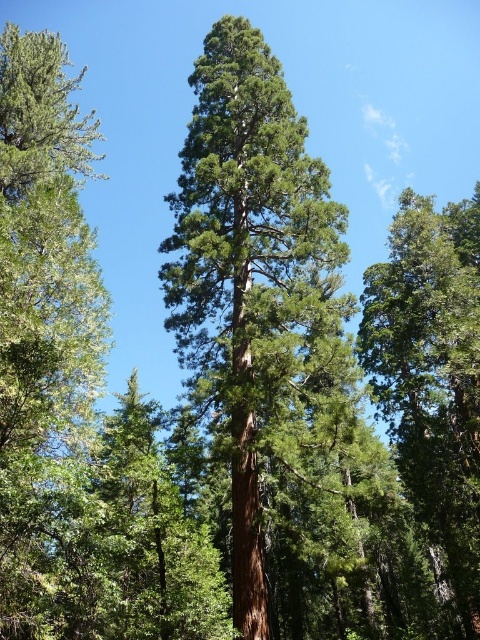
From the picture: Who is shorter, green rough bark tree at center or green matte tree at center?

green matte tree at center is shorter.

Can you confirm if green rough bark tree at center is bigger than green matte tree at center?

Yes, green rough bark tree at center is bigger than green matte tree at center.

Does point (223, 145) come behind point (427, 493)?

No.

Where is `green rough bark tree at center`? The width and height of the screenshot is (480, 640). green rough bark tree at center is located at coordinates (250, 268).

In the scene shown: Is green matte tree at left thinner than green matte tree at center?

Yes.

Identify the location of green matte tree at left. (44, 326).

The image size is (480, 640). Describe the element at coordinates (44, 326) in the screenshot. I see `green matte tree at left` at that location.

Find the location of `green matte tree at left`. green matte tree at left is located at coordinates (44, 326).

Is green rough bark tree at center in front of green matte tree at left?

No, green rough bark tree at center is further to the viewer.

Does point (216, 216) come farther from viewer compared to point (17, 568)?

Yes, point (216, 216) is behind point (17, 568).

Is point (308, 328) farther from camera compared to point (7, 362)?

Yes, it is.

This screenshot has height=640, width=480. Find the location of `green rough bark tree at center`. green rough bark tree at center is located at coordinates (250, 268).